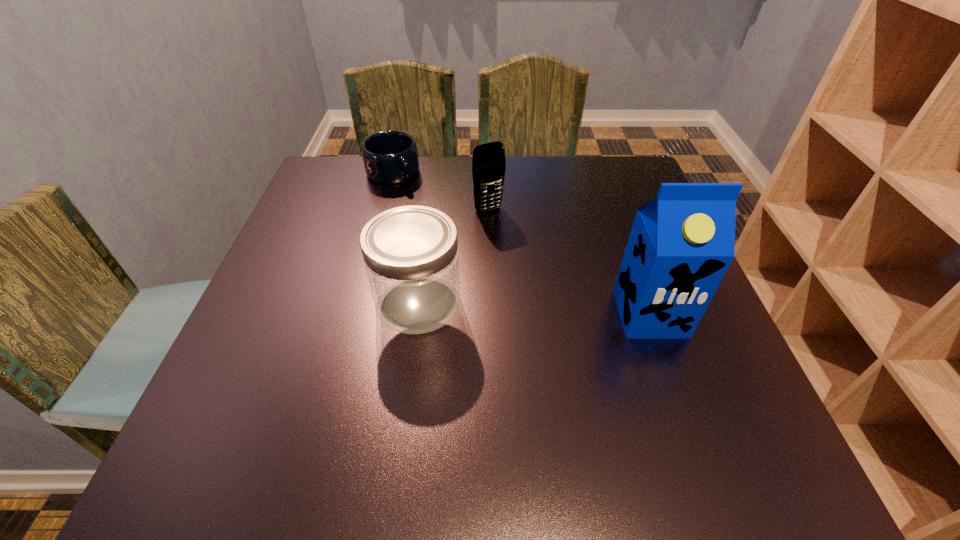
What are the coordinates of `empty space between the jar and the tallest object` in the screenshot? It's located at (534, 308).

This screenshot has width=960, height=540. Find the location of `unoccupied area between the carton and the shortest object`. unoccupied area between the carton and the shortest object is located at coordinates (521, 244).

Locate an element on the screen. Image resolution: width=960 pixels, height=540 pixels. the third closest object to the carton is located at coordinates (390, 157).

Locate which object ranks in proximity to the jar. Please provide its 2D coordinates. Your answer should be formatted as a tuple, i.e. [(x, y)], where the tuple contains the x and y coordinates of a point satisfying the conditions above.

[(488, 161)]